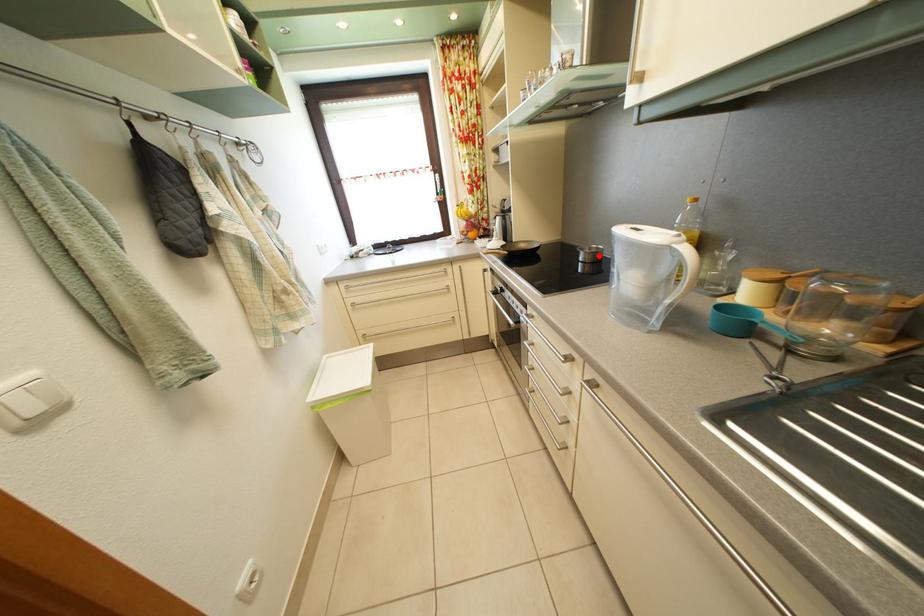
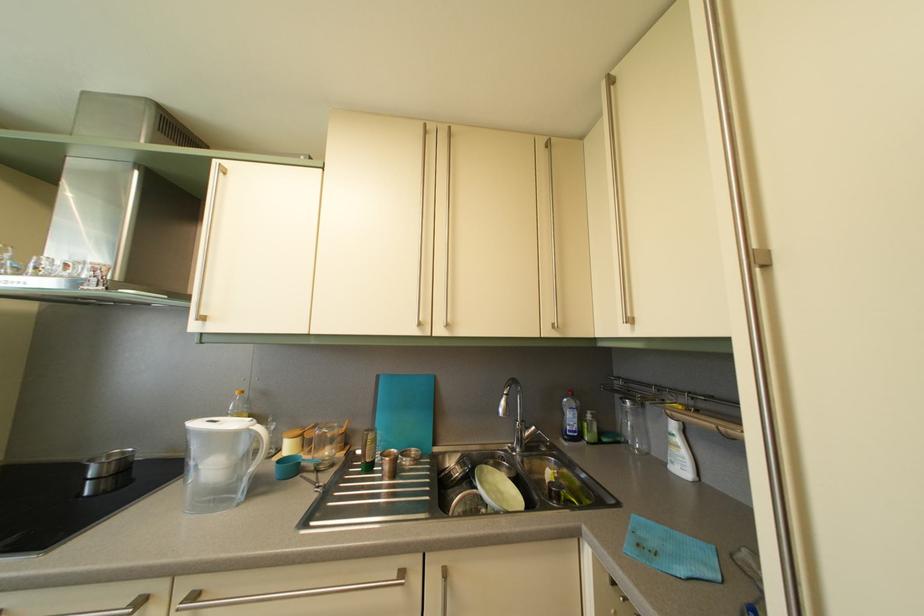
In the second image, find the point that corresponds to the highlighted location in the first image.

(118, 463)